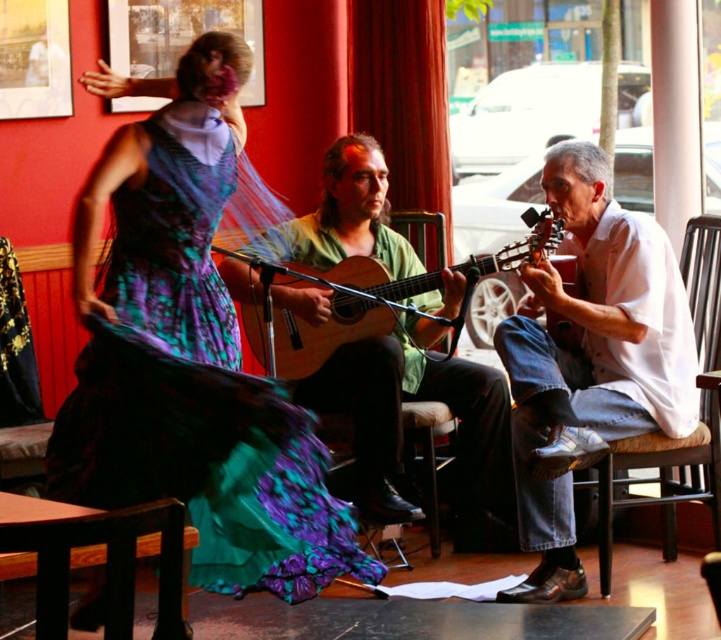
You are standing in the room and want to place a 10 feet wide banner between the point at coordinates [399,296] and the nearest wall. Will the banner fit?

The point at coordinates [399,296] is 13.62 feet away from the viewer. Since the banner is 10 feet wide, it will fit as long as the distance from the point to the nearest wall is at least 10 feet. However, the exact distance to the wall isn not provided, so we cannot confirm if it will fit without additional information.

You are a performer who needs to move from the wooden acoustic guitar at center to the wooden chair at center during a quick stage transition. Can you do this without moving more than 2 feet?

The wooden acoustic guitar at center is 22.41 inches away from wooden chair at center. Since 22.41 inches is approximately 1.87 feet, which is less than 2 feet, you can move from the wooden acoustic guitar at center to the wooden chair at center without exceeding the distance limit.

You are standing in the performance area and want to place a small microphone stand. You have two points marked as potential locations for the stand. The first point is at coordinate point (601, 413) and the second is at point (459, 396). Which point is closer to you where you can place the stand?

Point (601, 413) is closer to the viewer than point (459, 396), so you should place the microphone stand there.